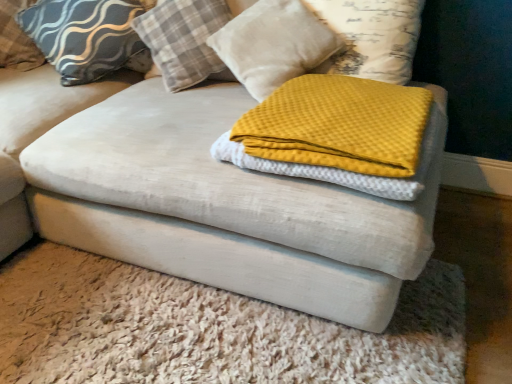
Image resolution: width=512 pixels, height=384 pixels. Describe the element at coordinates (86, 36) in the screenshot. I see `matte gray pillow at upper left, the second pillow in the left-to-right sequence` at that location.

What do you see at coordinates (208, 329) in the screenshot? I see `velvet ottoman at center` at bounding box center [208, 329].

This screenshot has height=384, width=512. Identify the location of yellow waffle knit blanket at center. (338, 134).

From a real-world perspective, who is located lower, matte gray pillow at upper left, the 3th pillow when ordered from right to left, or plaid fabric pillow at upper center, the third pillow viewed from the left?

matte gray pillow at upper left, the 3th pillow when ordered from right to left, from a real-world perspective.

Considering the relative positions of matte gray pillow at upper left, the 3th pillow when ordered from right to left, and plaid fabric pillow at upper center, the third pillow viewed from the left, in the image provided, is matte gray pillow at upper left, the 3th pillow when ordered from right to left, in front of plaid fabric pillow at upper center, the third pillow viewed from the left,?

That is False.

Identify the location of the 2nd pillow located above the matte gray pillow at upper left, the 3th pillow when ordered from right to left (from a real-world perspective). (183, 39).

Where is `the 3rd pillow to the left of the yellow waffle knit blanket at center, counting from the anchor's position`? Image resolution: width=512 pixels, height=384 pixels. the 3rd pillow to the left of the yellow waffle knit blanket at center, counting from the anchor's position is located at coordinates (86, 36).

Does yellow waffle knit blanket at center appear on the right side of matte gray pillow at upper left, the 3th pillow when ordered from right to left?

Yes.

Is matte gray pillow at upper left, the 3th pillow when ordered from right to left, located within yellow waffle knit blanket at center?

No, matte gray pillow at upper left, the 3th pillow when ordered from right to left, is located outside of yellow waffle knit blanket at center.

Considering the sizes of matte gray pillow at upper left, the 3th pillow when ordered from right to left, and yellow waffle knit blanket at center in the image, is matte gray pillow at upper left, the 3th pillow when ordered from right to left, taller or shorter than yellow waffle knit blanket at center?

Clearly, matte gray pillow at upper left, the 3th pillow when ordered from right to left, is taller compared to yellow waffle knit blanket at center.

Which is behind, point (132, 6) or point (293, 97)?

The point (132, 6) is farther.

Can you see matte gray pillow at upper left, the second pillow in the left-to-right sequence, touching yellow waffle knit blanket at center?

matte gray pillow at upper left, the second pillow in the left-to-right sequence, is not next to yellow waffle knit blanket at center, and they're not touching.

Would you consider waffle-textured yellow blanket at center, the 1th pillow when ordered from right to left, to be distant from matte gray pillow at upper left, the second pillow in the left-to-right sequence?

No, waffle-textured yellow blanket at center, the 1th pillow when ordered from right to left, is in close proximity to matte gray pillow at upper left, the second pillow in the left-to-right sequence.

From the image's perspective, which is below, waffle-textured yellow blanket at center, the 1th pillow when ordered from right to left, or matte gray pillow at upper left, the 3th pillow when ordered from right to left?

From the image's view, waffle-textured yellow blanket at center, the 1th pillow when ordered from right to left, is below.

Is waffle-textured yellow blanket at center, which is counted as the fourth pillow, starting from the left, at the right side of matte gray pillow at upper left, the second pillow in the left-to-right sequence?

Yes, waffle-textured yellow blanket at center, which is counted as the fourth pillow, starting from the left, is to the right of matte gray pillow at upper left, the second pillow in the left-to-right sequence.

Is waffle-textured yellow blanket at center, which is counted as the fourth pillow, starting from the left, bigger or smaller than matte gray pillow at upper left, the 3th pillow when ordered from right to left?

Clearly, waffle-textured yellow blanket at center, which is counted as the fourth pillow, starting from the left, is smaller in size than matte gray pillow at upper left, the 3th pillow when ordered from right to left.

Consider the image. Between plaid fabric pillow at upper center, the third pillow viewed from the left, and waffle-textured yellow blanket at center, which is counted as the fourth pillow, starting from the left, which one has smaller width?

Thinner between the two is plaid fabric pillow at upper center, the third pillow viewed from the left.

Does plaid fabric pillow at upper center, the third pillow viewed from the left, have a smaller size compared to waffle-textured yellow blanket at center, which is counted as the fourth pillow, starting from the left?

Correct, plaid fabric pillow at upper center, the third pillow viewed from the left, occupies less space than waffle-textured yellow blanket at center, which is counted as the fourth pillow, starting from the left.

Is the surface of plaid fabric pillow at upper center, marked as the 2th pillow in a right-to-left arrangement, in direct contact with waffle-textured yellow blanket at center, which is counted as the fourth pillow, starting from the left?

No, plaid fabric pillow at upper center, marked as the 2th pillow in a right-to-left arrangement, is not with waffle-textured yellow blanket at center, which is counted as the fourth pillow, starting from the left.

Can you confirm if plaid fabric pillow at upper center, marked as the 2th pillow in a right-to-left arrangement, is positioned to the left of waffle-textured yellow blanket at center, the 1th pillow when ordered from right to left?

Correct, you'll find plaid fabric pillow at upper center, marked as the 2th pillow in a right-to-left arrangement, to the left of waffle-textured yellow blanket at center, the 1th pillow when ordered from right to left.

Which of these two, yellow waffle knit blanket at center or plaid fabric pillow at upper center, the third pillow viewed from the left, is wider?

With larger width is yellow waffle knit blanket at center.

Is yellow waffle knit blanket at center not inside plaid fabric pillow at upper center, marked as the 2th pillow in a right-to-left arrangement?

Absolutely, yellow waffle knit blanket at center is external to plaid fabric pillow at upper center, marked as the 2th pillow in a right-to-left arrangement.

Starting from the yellow waffle knit blanket at center, which pillow is the 2nd one behind? Please provide its 2D coordinates.

[(183, 39)]

Visually, is yellow waffle knit blanket at center positioned to the left or to the right of plaid fabric pillow at upper center, marked as the 2th pillow in a right-to-left arrangement?

Clearly, yellow waffle knit blanket at center is on the right of plaid fabric pillow at upper center, marked as the 2th pillow in a right-to-left arrangement, in the image.

Considering the relative sizes of velvet ottoman at center and plaid fabric pillow at upper center, marked as the 2th pillow in a right-to-left arrangement, in the image provided, is velvet ottoman at center wider than plaid fabric pillow at upper center, marked as the 2th pillow in a right-to-left arrangement,?

Yes.

From the image's perspective, is velvet ottoman at center located beneath plaid fabric pillow at upper center, the third pillow viewed from the left?

Yes, from the image's perspective, velvet ottoman at center is below plaid fabric pillow at upper center, the third pillow viewed from the left.

In the image, is velvet ottoman at center positioned in front of or behind plaid fabric pillow at upper center, marked as the 2th pillow in a right-to-left arrangement?

Clearly, velvet ottoman at center is in front of plaid fabric pillow at upper center, marked as the 2th pillow in a right-to-left arrangement.

Which of these two, velvet ottoman at center or plaid fabric pillow at upper center, marked as the 2th pillow in a right-to-left arrangement, is smaller?

plaid fabric pillow at upper center, marked as the 2th pillow in a right-to-left arrangement.

Identify the location of the 1st pillow in front of the matte gray pillow at upper left, the 3th pillow when ordered from right to left. (x=183, y=39).

Locate an element on the screen. the 1st pillow located above the yellow waffle knit blanket at center (from a real-world perspective) is located at coordinates (86, 36).

Which object lies further to the anchor point plaid fabric pillow at upper center, marked as the 2th pillow in a right-to-left arrangement, textured gray pillow at upper left, which is the first pillow from left to right, or matte gray pillow at upper left, the 3th pillow when ordered from right to left?

textured gray pillow at upper left, which is the first pillow from left to right, is further to plaid fabric pillow at upper center, marked as the 2th pillow in a right-to-left arrangement.

Based on their spatial positions, is plaid fabric pillow at upper center, the third pillow viewed from the left, or velvet ottoman at center further from textured gray pillow at upper left, which is the first pillow from left to right?

velvet ottoman at center.

From the image, which object appears to be nearer to yellow waffle knit blanket at center, matte gray pillow at upper left, the second pillow in the left-to-right sequence, or waffle-textured yellow blanket at center, which is counted as the fourth pillow, starting from the left?

Based on the image, waffle-textured yellow blanket at center, which is counted as the fourth pillow, starting from the left, appears to be nearer to yellow waffle knit blanket at center.

Looking at the image, which one is located closer to matte gray pillow at upper left, the 3th pillow when ordered from right to left, plaid fabric pillow at upper center, the third pillow viewed from the left, or yellow waffle knit blanket at center?

The object closer to matte gray pillow at upper left, the 3th pillow when ordered from right to left, is plaid fabric pillow at upper center, the third pillow viewed from the left.

Considering their positions, is textured gray pillow at upper left, which is the first pillow from left to right, positioned further to matte gray pillow at upper left, the second pillow in the left-to-right sequence, than yellow waffle knit blanket at center?

yellow waffle knit blanket at center is further to matte gray pillow at upper left, the second pillow in the left-to-right sequence.

Based on their spatial positions, is yellow waffle knit blanket at center or textured gray pillow at upper left, which is the first pillow from left to right, closer to waffle-textured yellow blanket at center, the 1th pillow when ordered from right to left?

Among the two, yellow waffle knit blanket at center is located nearer to waffle-textured yellow blanket at center, the 1th pillow when ordered from right to left.

Considering their positions, is waffle-textured yellow blanket at center, which is counted as the fourth pillow, starting from the left, positioned closer to velvet ottoman at center than yellow waffle knit blanket at center?

Based on the image, yellow waffle knit blanket at center appears to be nearer to velvet ottoman at center.

Consider the image. Looking at the image, which one is located further to velvet ottoman at center, textured gray pillow at upper left, which is the first pillow from left to right, or plaid fabric pillow at upper center, marked as the 2th pillow in a right-to-left arrangement?

The object further to velvet ottoman at center is textured gray pillow at upper left, which is the first pillow from left to right.

The width and height of the screenshot is (512, 384). I want to click on cloth between waffle-textured yellow blanket at center, which is counted as the fourth pillow, starting from the left, and velvet ottoman at center from top to bottom, so click(x=338, y=134).

Find the location of a particular element. pillow between textured gray pillow at upper left, which appears as the 4th pillow when viewed from the right, and plaid fabric pillow at upper center, the third pillow viewed from the left is located at coordinates (86, 36).

Identify the location of pillow between matte gray pillow at upper left, the second pillow in the left-to-right sequence, and waffle-textured yellow blanket at center, which is counted as the fourth pillow, starting from the left, in the horizontal direction. This screenshot has height=384, width=512. (183, 39).

Image resolution: width=512 pixels, height=384 pixels. In order to click on cloth between plaid fabric pillow at upper center, marked as the 2th pillow in a right-to-left arrangement, and velvet ottoman at center in the up-down direction in this screenshot , I will do (338, 134).